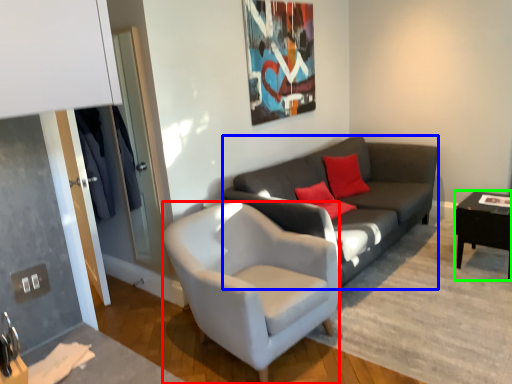
Question: Considering the real-world distances, which object is farthest from chair (highlighted by a red box)? studio couch (highlighted by a blue box) or table (highlighted by a green box)?

Choices:
 (A) studio couch
 (B) table

Answer: (B)